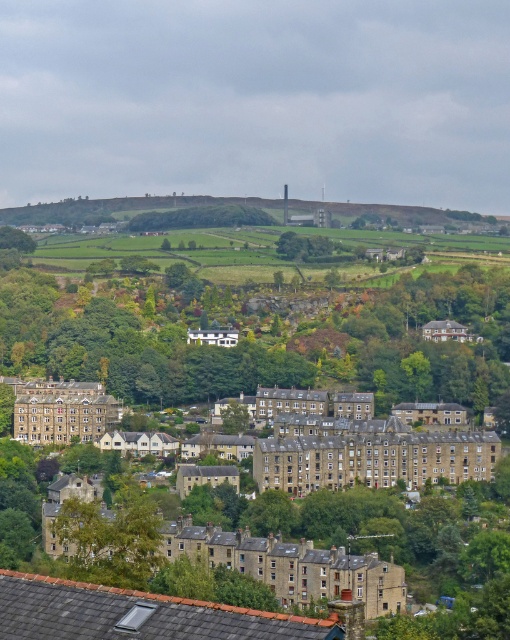
Who is positioned more to the left, green leafy tree at lower left or green leafy tree at center?

green leafy tree at lower left is more to the left.

Is point (151, 536) farther from camera compared to point (235, 225)?

No, (151, 536) is closer to viewer.

Between point (157, 540) and point (178, 216), which one is positioned in front?

Point (157, 540) is more forward.

Locate an element on the screen. Image resolution: width=510 pixels, height=640 pixels. green leafy tree at lower left is located at coordinates (111, 540).